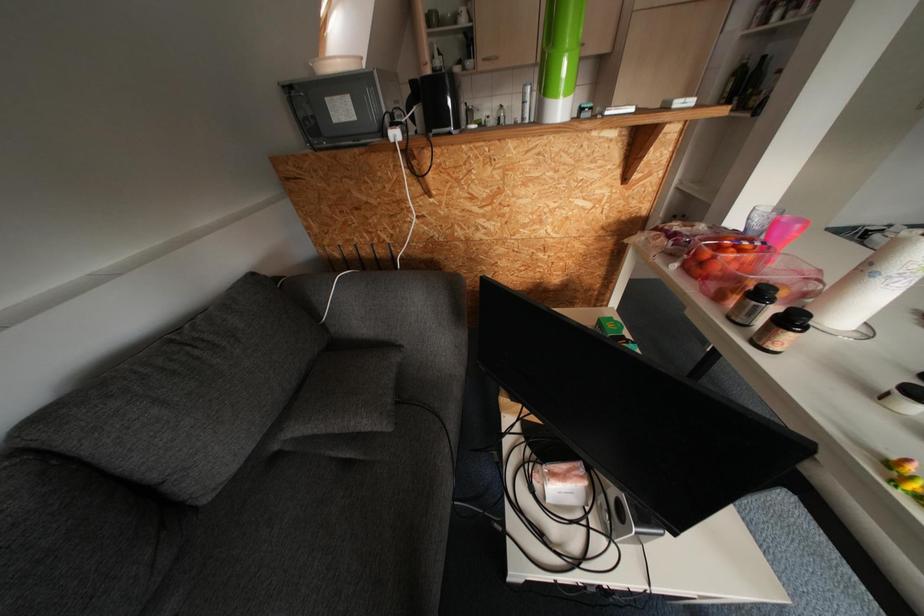
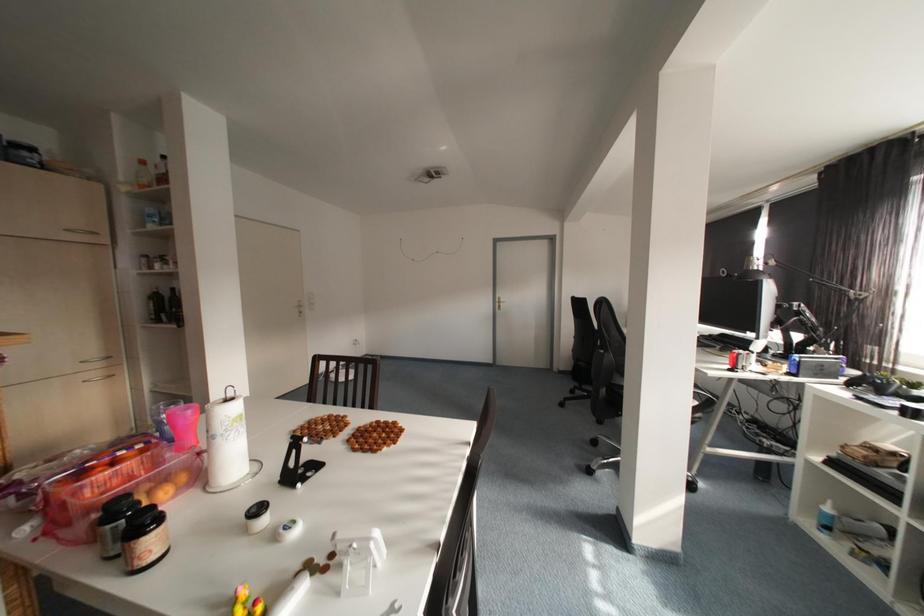
Question: The first image is from the beginning of the video and the second image is from the end. How did the camera likely rotate when shooting the video?

Choices:
 (A) Left
 (B) Right
 (C) Up
 (D) Down

Answer: (B)